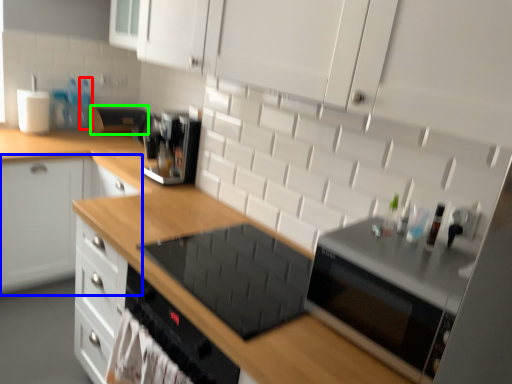
Question: Based on their relative distances, which object is nearer to bottle (highlighted by a red box)? Choose from cabinetry (highlighted by a blue box) and appliance (highlighted by a green box).

Choices:
 (A) cabinetry
 (B) appliance

Answer: (B)